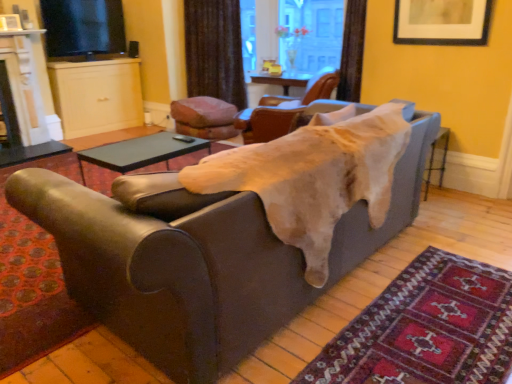
Locate an element on the screen. The width and height of the screenshot is (512, 384). leather chair at center, marked as the second chair in a right-to-left arrangement is located at coordinates (282, 111).

This screenshot has width=512, height=384. What do you see at coordinates (22, 102) in the screenshot?
I see `matte white fireplace at left` at bounding box center [22, 102].

The width and height of the screenshot is (512, 384). What are the coordinates of `matte white fireplace at left` in the screenshot? It's located at (22, 102).

In order to click on black matte table at center in this screenshot , I will do `click(132, 157)`.

I want to click on leather chair at center, marked as the second chair in a right-to-left arrangement, so click(282, 111).

Do you think carpet at lower right is within black glossy tv at upper left, or outside of it?

carpet at lower right is spatially situated outside black glossy tv at upper left.

Can you confirm if carpet at lower right is bigger than black glossy tv at upper left?

Incorrect, carpet at lower right is not larger than black glossy tv at upper left.

From a real-world perspective, which object rests below the other?

In real-world perspective, carpet at lower right is lower.

Who is shorter, carpet at lower right or black glossy tv at upper left?

Standing shorter between the two is carpet at lower right.

Is leather chair at center, marked as the second chair in a right-to-left arrangement, taller than leather couch at center?

Yes.

Consider the image. Is leather chair at center, marked as the second chair in a right-to-left arrangement, turned away from leather couch at center?

No, leather chair at center, marked as the second chair in a right-to-left arrangement,'s orientation is not away from leather couch at center.

Is leather chair at center, the 2th chair viewed from the left, positioned beyond the bounds of leather couch at center?

Yes, leather chair at center, the 2th chair viewed from the left, is located beyond the bounds of leather couch at center.

Is brown fabric curtain at upper center next to matte white fireplace at left and touching it?

There is a gap between brown fabric curtain at upper center and matte white fireplace at left.

Between brown fabric curtain at upper center and matte white fireplace at left, which one has larger width?

matte white fireplace at left is wider.

From a real-world perspective, is brown fabric curtain at upper center located beneath matte white fireplace at left?

No, from a real-world perspective, brown fabric curtain at upper center is not below matte white fireplace at left.

Who is taller, brown fabric curtain at upper center or matte white fireplace at left?

With more height is brown fabric curtain at upper center.

Is black matte table at center with matte black picture frame at upper right?

There is a gap between black matte table at center and matte black picture frame at upper right.

How far apart are black matte table at center and matte black picture frame at upper right?

black matte table at center and matte black picture frame at upper right are 6.92 feet apart from each other.

Does black matte table at center appear on the left side of matte black picture frame at upper right?

Correct, you'll find black matte table at center to the left of matte black picture frame at upper right.

Choose the correct answer: Is black matte table at center inside matte black picture frame at upper right or outside it?

black matte table at center is outside matte black picture frame at upper right.

Considering the points (342, 14) and (219, 92), which point is in front, point (342, 14) or point (219, 92)?

The point (342, 14) is closer.

Considering the relative sizes of transparent glass door at upper center and brown fabric curtain at upper center in the image provided, is transparent glass door at upper center thinner than brown fabric curtain at upper center?

No.

Between transparent glass door at upper center and brown fabric curtain at upper center, which one is positioned behind?

brown fabric curtain at upper center is further from the camera.

This screenshot has height=384, width=512. Find the location of `glass door in front of the brown fabric curtain at upper center`. glass door in front of the brown fabric curtain at upper center is located at coordinates (291, 34).

I want to click on glass door that is behind the black matte table at center, so click(291, 34).

Is transparent glass door at upper center completely or partially inside black matte table at center?

No, transparent glass door at upper center is not surrounded by black matte table at center.

Can you see black matte table at center touching transparent glass door at upper center?

black matte table at center is not next to transparent glass door at upper center, and they're not touching.

From a real-world perspective, is black matte table at center positioned under transparent glass door at upper center based on gravity?

Correct, in the physical world, black matte table at center is lower than transparent glass door at upper center.

What's the angular difference between black glossy tv at upper left and brown fabric curtain at upper center's facing directions?

45.3 degrees.

Is point (109, 47) closer to viewer compared to point (234, 17)?

No, it is not.

From a real-world perspective, is black glossy tv at upper left over brown fabric curtain at upper center?

Yes, from a real-world perspective, black glossy tv at upper left is over brown fabric curtain at upper center

At what (x,y) coordinates should I click in order to perform the action: click on window screen behind the carpet at lower right. Please return your answer as a coordinate pair (x, y). This screenshot has width=512, height=384. Looking at the image, I should click on (83, 28).

You are a GUI agent. You are given a task and a screenshot of the screen. Output one action in this format:
    pyautogui.click(x=<x>, y=<y>)
    Task: Click on the studio couch on the left of leather chair at center, the 2th chair viewed from the left
    
    Given the screenshot: What is the action you would take?
    pyautogui.click(x=198, y=258)

Which object lies further to the anchor point black glossy tv at upper left, carpet at lower right or brown fabric curtain at upper center?

carpet at lower right is further to black glossy tv at upper left.

When comparing their distances from brown fabric curtain at upper center, does black glossy tv at upper left or velvet-like brown cushion at center, the 3th chair in the right-to-left sequence, seem further?

Based on the image, velvet-like brown cushion at center, the 3th chair in the right-to-left sequence, appears to be further to brown fabric curtain at upper center.

Which object lies further to the anchor point leather couch at center, brown leather chair at upper center, which is the 1th chair from right to left, or carpet at lower right?

brown leather chair at upper center, which is the 1th chair from right to left, is positioned further to the anchor leather couch at center.

From the image, which object appears to be farther from leather couch at center, brown fabric curtain at upper center or black glossy tv at upper left?

black glossy tv at upper left is positioned further to the anchor leather couch at center.

Estimate the real-world distances between objects in this image. Which object is further from brown leather chair at upper center, the 3th chair from the left, leather couch at center or transparent glass door at upper center?

The object further to brown leather chair at upper center, the 3th chair from the left, is leather couch at center.

Which object lies further to the anchor point black matte table at center, leather couch at center or brown fabric curtain at upper center?

Among the two, brown fabric curtain at upper center is located further to black matte table at center.

Based on their spatial positions, is transparent glass door at upper center or leather couch at center closer to velvet-like brown cushion at center, the 1th chair positioned from the left?

leather couch at center.

Considering their positions, is matte white fireplace at left positioned further to brown fabric curtain at upper center than leather chair at center, marked as the second chair in a right-to-left arrangement?

Based on the image, matte white fireplace at left appears to be further to brown fabric curtain at upper center.

Locate an element on the screen. The height and width of the screenshot is (384, 512). table positioned between leather couch at center and leather chair at center, the 2th chair viewed from the left, from near to far is located at coordinates (132, 157).

This screenshot has width=512, height=384. I want to click on curtain situated between matte white fireplace at left and transparent glass door at upper center from left to right, so click(214, 50).

Where is `fireplace positioned between leather couch at center and black glossy tv at upper left from near to far`? fireplace positioned between leather couch at center and black glossy tv at upper left from near to far is located at coordinates (22, 102).

The width and height of the screenshot is (512, 384). Find the location of `window screen between leather couch at center and transparent glass door at upper center from front to back`. window screen between leather couch at center and transparent glass door at upper center from front to back is located at coordinates coord(83,28).